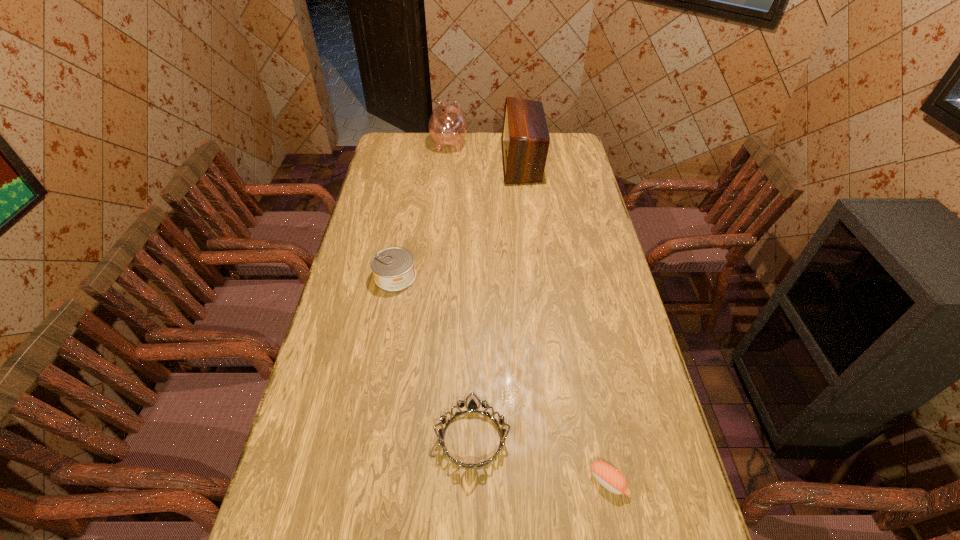
The height and width of the screenshot is (540, 960). In order to click on radio receiver in this screenshot , I will do `click(525, 141)`.

Image resolution: width=960 pixels, height=540 pixels. I want to click on the fourth shortest object, so click(448, 125).

Identify the location of the third farthest object. (394, 270).

Where is `tiara`? The height and width of the screenshot is (540, 960). tiara is located at coordinates (472, 406).

The image size is (960, 540). Identify the location of the shortest object. (609, 477).

You are a GUI agent. You are given a task and a screenshot of the screen. Output one action in this format:
    pyautogui.click(x=<x>, y=<y>)
    Task: Click on the vacant area situated 0.290m on the front-facing side of the radio receiver
    
    Given the screenshot: What is the action you would take?
    pyautogui.click(x=439, y=162)

Identify the location of vacant point located on the front-facing side of the radio receiver. Image resolution: width=960 pixels, height=540 pixels. (417, 162).

Where is `free point located 0.190m on the front-facing side of the radio receiver`? This screenshot has width=960, height=540. free point located 0.190m on the front-facing side of the radio receiver is located at coordinates (461, 162).

At what (x,y) coordinates should I click in order to perform the action: click on vacant region located on the front of the can. Please return your answer as a coordinate pair (x, y). Looking at the image, I should click on (377, 377).

Identify the location of vacant space located on the front-facing side of the fourth tallest object. The image size is (960, 540). (633, 438).